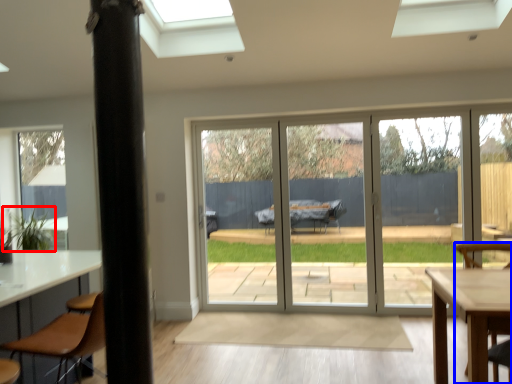
Question: Among these objects, which one is farthest to the camera, plant (highlighted by a red box) or chair (highlighted by a blue box)?

Choices:
 (A) plant
 (B) chair

Answer: (A)